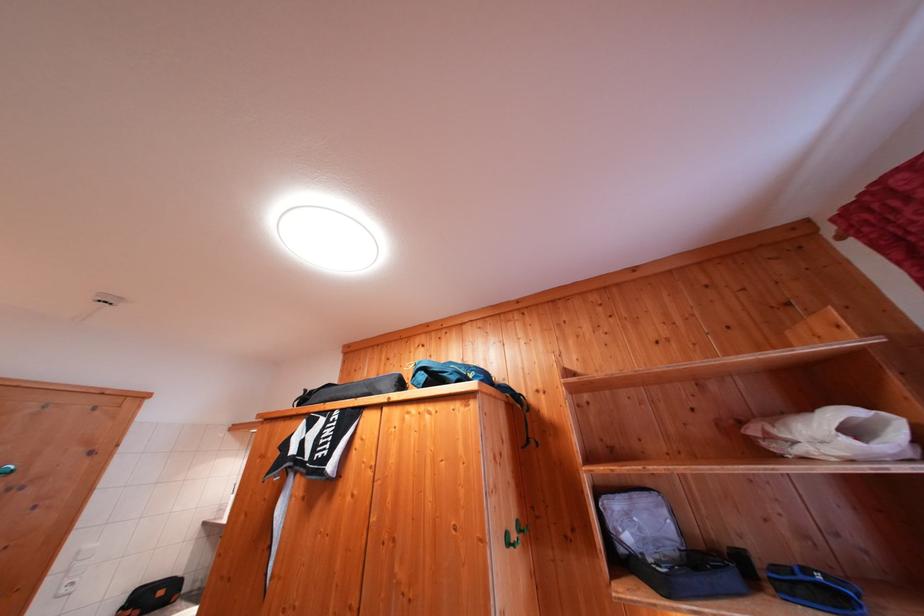
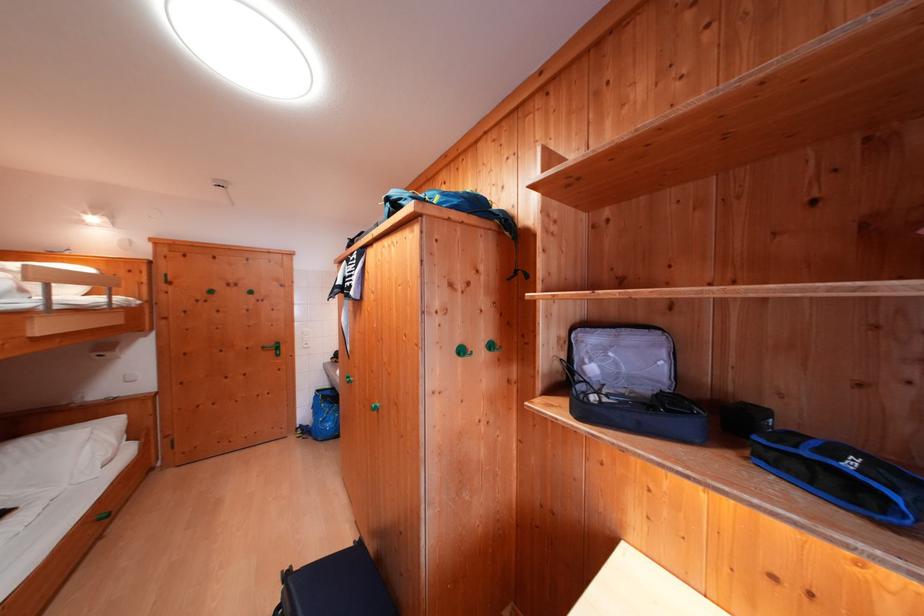
In the second image, find the point that corresponds to (x=811, y=582) in the first image.

(815, 456)